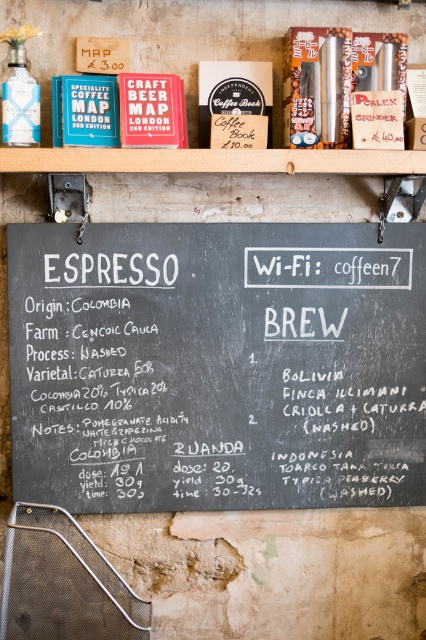
Can you confirm if black chalkboard at center is bigger than wooden at upper center?

Actually, black chalkboard at center might be smaller than wooden at upper center.

Which of these two, black chalkboard at center or wooden at upper center, stands shorter?

wooden at upper center

The width and height of the screenshot is (426, 640). In order to click on black chalkboard at center in this screenshot , I will do `click(216, 365)`.